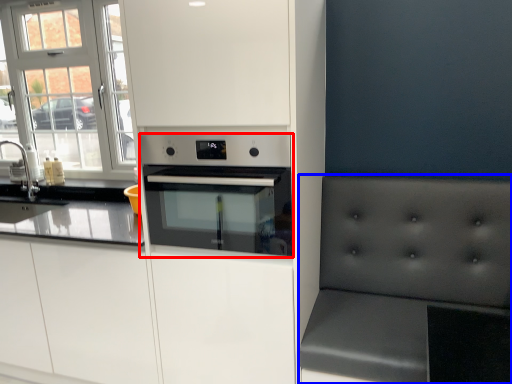
Question: Among these objects, which one is farthest to the camera, home appliance (highlighted by a red box) or armchair (highlighted by a blue box)?

Choices:
 (A) home appliance
 (B) armchair

Answer: (A)